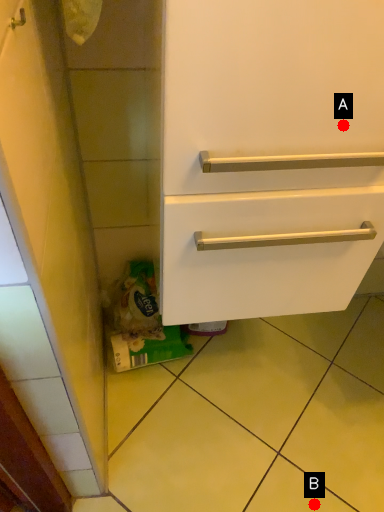
Question: Two points are circled on the image, labeled by A and B beside each circle. Which point is farther to the camera?

Choices:
 (A) A is further
 (B) B is further

Answer: (B)